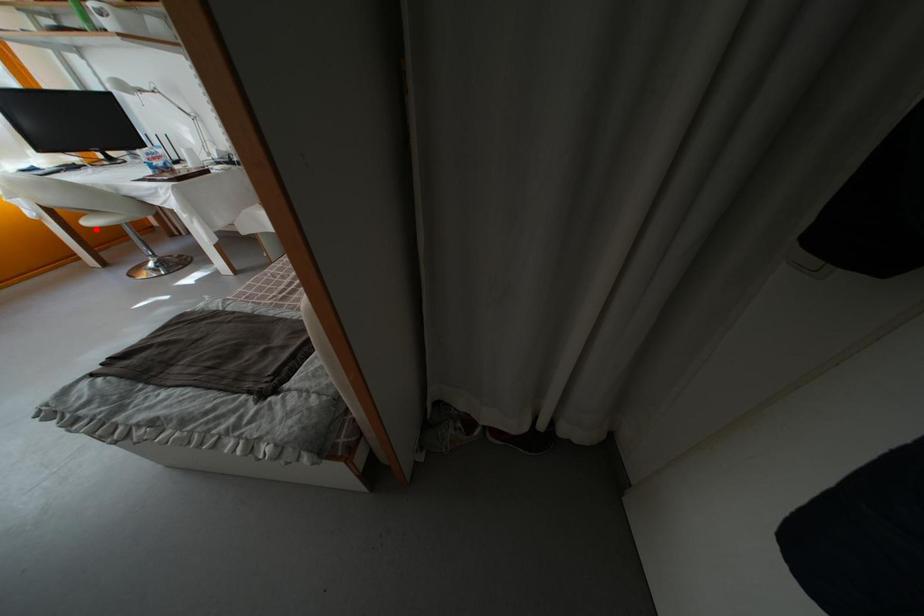
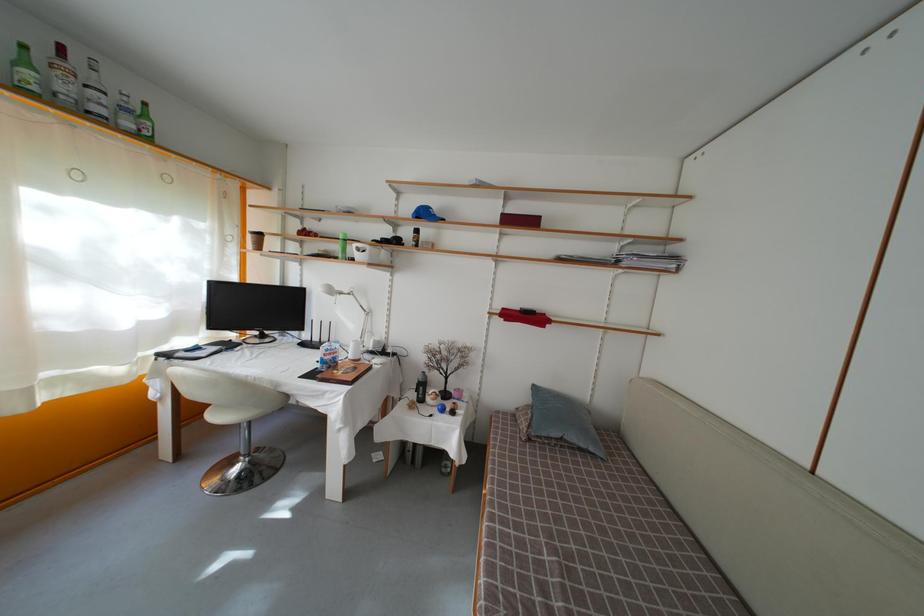
Locate, in the second image, the point that corresponds to the highlighted location in the first image.

(221, 422)